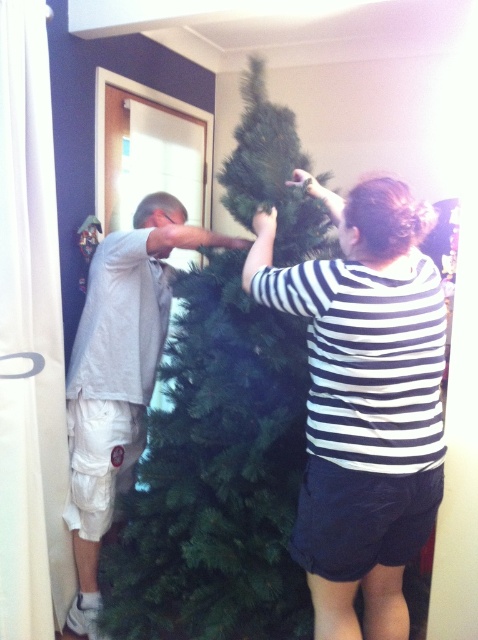
You are planning to place a decorative star on top of the green artificial christmas tree at center. Considering the size of the striped shirt at center, will the star fit on the tree without being obscured?

The green artificial christmas tree at center is bigger than the striped shirt at center, so the star should fit without being obscured as the tree is larger than the shirt.

You are standing in the living room and want to place a decoration at the point marked as point (339, 404). If your arm reaches 1.5 meters, can you reach that point?

The distance of point (339, 404) from viewer is 1.46 meters, so yes, your arm can reach it since it is within the 1.5 meters range.